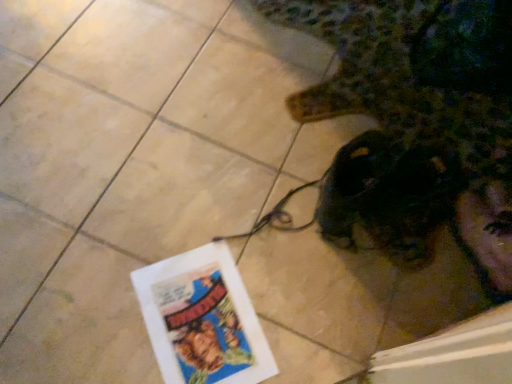
Where is `shiny black headphones at lower right`? Image resolution: width=512 pixels, height=384 pixels. shiny black headphones at lower right is located at coordinates (416, 124).

This screenshot has width=512, height=384. Describe the element at coordinates (416, 124) in the screenshot. I see `shiny black headphones at lower right` at that location.

I want to click on white paper flyer at lower left, so click(202, 319).

What do you see at coordinates (202, 319) in the screenshot? I see `white paper flyer at lower left` at bounding box center [202, 319].

Identify the location of shiny black headphones at lower right. (416, 124).

Considering the relative positions of shiny black headphones at lower right and white paper flyer at lower left in the image provided, is shiny black headphones at lower right to the left of white paper flyer at lower left from the viewer's perspective?

No.

Is the depth of shiny black headphones at lower right greater than that of white paper flyer at lower left?

No, it is in front of white paper flyer at lower left.

Between point (390, 55) and point (157, 264), which one is positioned behind?

The point (390, 55) is farther from the camera.

From the image's perspective, which one is positioned lower, shiny black headphones at lower right or white paper flyer at lower left?

white paper flyer at lower left appears lower in the image.

From a real-world perspective, is shiny black headphones at lower right below white paper flyer at lower left?

No, from a real-world perspective, shiny black headphones at lower right is not beneath white paper flyer at lower left.

Looking at their sizes, would you say shiny black headphones at lower right is wider or thinner than white paper flyer at lower left?

Clearly, shiny black headphones at lower right has more width compared to white paper flyer at lower left.

Does shiny black headphones at lower right have a lesser height compared to white paper flyer at lower left?

Incorrect, the height of shiny black headphones at lower right does not fall short of that of white paper flyer at lower left.

In terms of size, does shiny black headphones at lower right appear bigger or smaller than white paper flyer at lower left?

shiny black headphones at lower right is bigger than white paper flyer at lower left.

Is shiny black headphones at lower right not within white paper flyer at lower left?

Indeed, shiny black headphones at lower right is completely outside white paper flyer at lower left.

Is shiny black headphones at lower right positioned far away from white paper flyer at lower left?

That's not correct — shiny black headphones at lower right is a little close to white paper flyer at lower left.

Is white paper flyer at lower left at the back of shiny black headphones at lower right?

shiny black headphones at lower right is not turned away from white paper flyer at lower left.

Measure the distance between shiny black headphones at lower right and white paper flyer at lower left.

shiny black headphones at lower right is 21.14 inches away from white paper flyer at lower left.

The height and width of the screenshot is (384, 512). Find the location of `flyer below the shiny black headphones at lower right (from a real-world perspective)`. flyer below the shiny black headphones at lower right (from a real-world perspective) is located at coordinates click(x=202, y=319).

From the picture: Which is more to the right, white paper flyer at lower left or shiny black headphones at lower right?

From the viewer's perspective, shiny black headphones at lower right appears more on the right side.

Between white paper flyer at lower left and shiny black headphones at lower right, which one is positioned behind?

white paper flyer at lower left is further away from the camera.

Which point is more forward, (190, 268) or (378, 215)?

The point (190, 268) is more forward.

From the image's perspective, is white paper flyer at lower left located above or below shiny black headphones at lower right?

From the image's perspective, white paper flyer at lower left appears below shiny black headphones at lower right.

From a real-world perspective, is white paper flyer at lower left located beneath shiny black headphones at lower right?

Yes, from a real-world perspective, white paper flyer at lower left is beneath shiny black headphones at lower right.

Considering the sizes of white paper flyer at lower left and shiny black headphones at lower right in the image, is white paper flyer at lower left wider or thinner than shiny black headphones at lower right?

Clearly, white paper flyer at lower left has less width compared to shiny black headphones at lower right.

Based on the photo, from their relative heights in the image, would you say white paper flyer at lower left is taller or shorter than shiny black headphones at lower right?

In the image, white paper flyer at lower left appears to be shorter than shiny black headphones at lower right.

Is white paper flyer at lower left bigger than shiny black headphones at lower right?

No.

In the scene shown: Can shiny black headphones at lower right be found inside white paper flyer at lower left?

No, shiny black headphones at lower right is located outside of white paper flyer at lower left.

Is white paper flyer at lower left not near shiny black headphones at lower right?

No, white paper flyer at lower left is not far from shiny black headphones at lower right.

Is white paper flyer at lower left aimed at shiny black headphones at lower right?

No, white paper flyer at lower left is not turned towards shiny black headphones at lower right.

How many degrees apart are the facing directions of white paper flyer at lower left and shiny black headphones at lower right?

There is a 90-degree angle between the facing directions of white paper flyer at lower left and shiny black headphones at lower right.

How far apart are white paper flyer at lower left and shiny black headphones at lower right?

The distance of white paper flyer at lower left from shiny black headphones at lower right is 21.14 inches.

This screenshot has height=384, width=512. Identify the location of flyer directly beneath the shiny black headphones at lower right (from a real-world perspective). (202, 319).

In order to click on animal that appears in front of the white paper flyer at lower left in this screenshot , I will do `click(416, 124)`.

The width and height of the screenshot is (512, 384). I want to click on flyer behind the shiny black headphones at lower right, so click(202, 319).